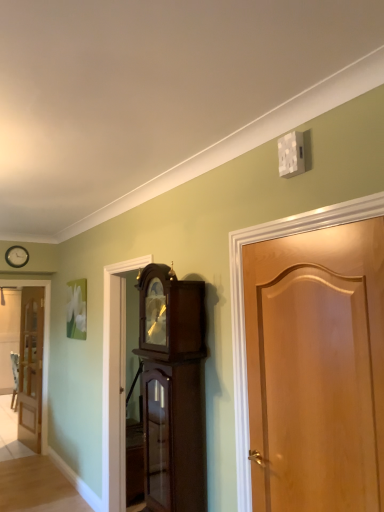
Question: Is point (31, 340) positioned closer to the camera than point (352, 237)?

Choices:
 (A) closer
 (B) farther

Answer: (B)

Question: Looking at the image, does light brown wooden door at left, the second door in the front-to-back sequence, seem bigger or smaller compared to light brown wood door at right, the 1th door when ordered from front to back?

Choices:
 (A) big
 (B) small

Answer: (A)

Question: Estimate the real-world distances between objects in this image. Which object is farther from the light brown wooden door at left, the second door in the front-to-back sequence?

Choices:
 (A) matte black clock at upper left
 (B) light brown wood door at right, which is the 1th door in right-to-left order
 (C) dark wood grandfather clock at center

Answer: (B)

Question: Estimate the real-world distances between objects in this image. Which object is closer to the light brown wood door at right, arranged as the second door when viewed from the back?

Choices:
 (A) matte black clock at upper left
 (B) dark wood grandfather clock at center
 (C) light brown wooden door at left, placed as the 1th door when sorted from back to front

Answer: (B)